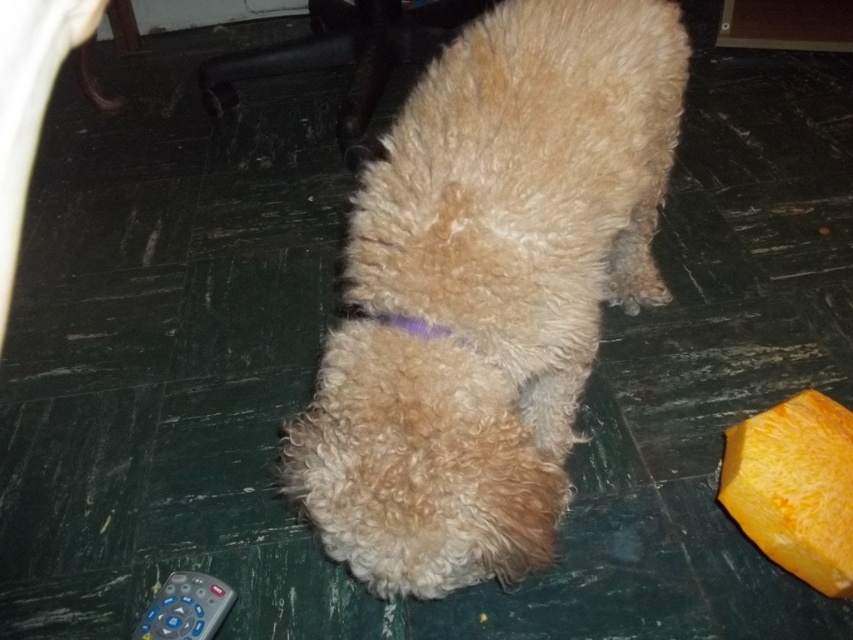
Does fuzzy beige dog at center have a smaller size compared to orange smooth pumpkin at lower right?

No.

Between fuzzy beige dog at center and orange smooth pumpkin at lower right, which one is positioned lower?

orange smooth pumpkin at lower right is lower down.

Locate an element on the screen. This screenshot has width=853, height=640. fuzzy beige dog at center is located at coordinates (486, 291).

You are a GUI agent. You are given a task and a screenshot of the screen. Output one action in this format:
    pyautogui.click(x=<x>, y=<y>)
    Task: Click on the fuzzy beige dog at center
    This screenshot has width=853, height=640.
    Given the screenshot: What is the action you would take?
    pyautogui.click(x=486, y=291)

Is fuzzy beige dog at center below gray plastic remote at lower left?

No.

Can you confirm if fuzzy beige dog at center is thinner than gray plastic remote at lower left?

Incorrect, fuzzy beige dog at center's width is not less than gray plastic remote at lower left's.

I want to click on fuzzy beige dog at center, so click(486, 291).

Does orange smooth pumpkin at lower right have a smaller size compared to gray plastic remote at lower left?

No, orange smooth pumpkin at lower right is not smaller than gray plastic remote at lower left.

Consider the image. Which of these two, orange smooth pumpkin at lower right or gray plastic remote at lower left, stands taller?

orange smooth pumpkin at lower right

Who is more forward, (775, 561) or (218, 584)?

Point (775, 561)

The image size is (853, 640). I want to click on orange smooth pumpkin at lower right, so click(x=793, y=486).